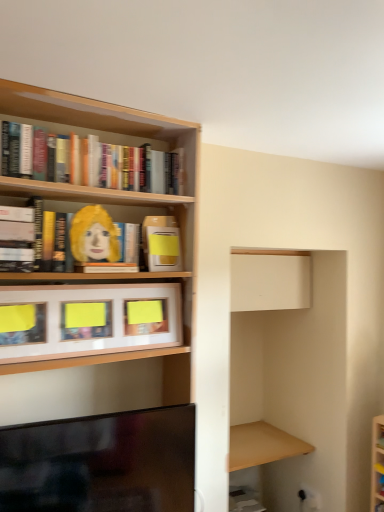
Question: Does wooden frame at center, which is the second cabinet from back to front, turn towards matte yellow book at upper left, which is the 2th book from top to bottom?

Choices:
 (A) no
 (B) yes

Answer: (A)

Question: Is wooden frame at center, which is the second cabinet from back to front, beside matte yellow book at upper left, which is the 2th book from top to bottom?

Choices:
 (A) no
 (B) yes

Answer: (A)

Question: Is wooden frame at center, which is the second cabinet from back to front, wider than matte yellow book at upper left, the 3th book ordered from the bottom?

Choices:
 (A) no
 (B) yes

Answer: (A)

Question: Can matte yellow book at upper left, the 3th book ordered from the bottom, be found inside wooden frame at center, which is the second cabinet from back to front?

Choices:
 (A) no
 (B) yes

Answer: (A)

Question: Can you confirm if wooden frame at center, which is the second cabinet from back to front, is positioned to the right of matte yellow book at upper left, which is the 2th book from top to bottom?

Choices:
 (A) yes
 (B) no

Answer: (A)

Question: In the image, is hardcover book at left, the 3th book when ordered from top to bottom, positioned in front of or behind matte yellow book at upper center, arranged as the first book when ordered from the bottom?

Choices:
 (A) front
 (B) behind

Answer: (A)

Question: Choose the correct answer: Is hardcover book at left, the 3th book when ordered from top to bottom, inside matte yellow book at upper center, arranged as the first book when ordered from the bottom, or outside it?

Choices:
 (A) outside
 (B) inside

Answer: (A)

Question: Considering the positions of point (21, 223) and point (172, 218), is point (21, 223) closer or farther from the camera than point (172, 218)?

Choices:
 (A) farther
 (B) closer

Answer: (B)

Question: From a real-world perspective, is hardcover book at left, the 3th book when ordered from top to bottom, above or below matte yellow book at upper center, acting as the 4th book starting from the top?

Choices:
 (A) above
 (B) below

Answer: (A)

Question: Does point tap(105, 261) appear closer or farther from the camera than point tap(14, 228)?

Choices:
 (A) closer
 (B) farther

Answer: (B)

Question: In terms of height, does matte yellow paper at upper left look taller or shorter compared to hardcover book at left, acting as the 2th book starting from the bottom?

Choices:
 (A) short
 (B) tall

Answer: (A)

Question: From a real-world perspective, relative to hardcover book at left, acting as the 2th book starting from the bottom, is matte yellow paper at upper left vertically above or below?

Choices:
 (A) above
 (B) below

Answer: (A)

Question: Is matte yellow paper at upper left wider or thinner than hardcover book at left, the 3th book when ordered from top to bottom?

Choices:
 (A) thin
 (B) wide

Answer: (A)

Question: From the image's perspective, relative to matte yellow book at upper center, acting as the 4th book starting from the top, is white matte cabinet at upper center, the second cabinet in the front-to-back sequence, above or below?

Choices:
 (A) below
 (B) above

Answer: (A)

Question: Which is correct: white matte cabinet at upper center, the second cabinet in the front-to-back sequence, is inside matte yellow book at upper center, arranged as the first book when ordered from the bottom, or outside of it?

Choices:
 (A) outside
 (B) inside

Answer: (A)